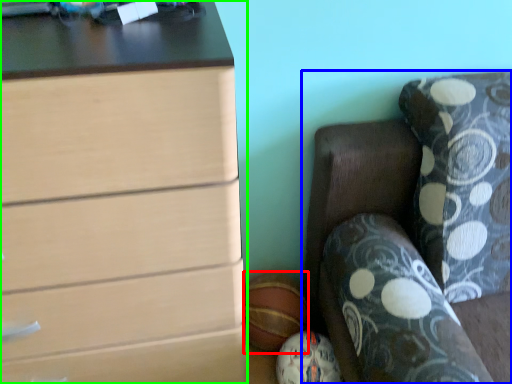
Question: Considering the real-world distances, which object is farthest from sports equipment (highlighted by a red box)? furniture (highlighted by a blue box) or chest of drawers (highlighted by a green box)?

Choices:
 (A) furniture
 (B) chest of drawers

Answer: (B)